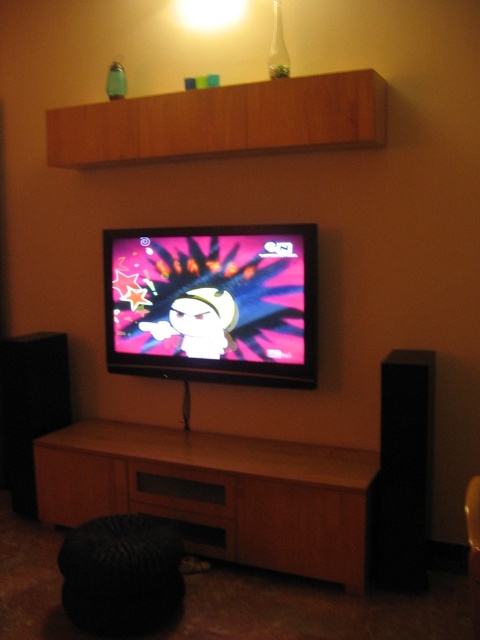
You are setting up a new shelf in the living room and need to know the relative widths of the wooden cabinet at lower center and the black matte speaker at left. Which one is wider?

The wooden cabinet at lower center is wider than the black matte speaker at left according to the description.

You are planning to place a new decorative item on the wooden cabinet at lower center and the black matte speaker at left. If the decorative item requires a surface area of 0.5 square meters, will both objects have enough space individually?

The wooden cabinet at lower center is larger in size than the black matte speaker at left. Therefore, the wooden cabinet at lower center likely has enough space for the decorative item, but the black matte speaker at left may not due to its smaller size.

You are setting up a new TV stand that can only support items up to the size of the black matte speaker at left. Can the flat screen tv at center be placed on this stand?

The flat screen tv at center is bigger than the black matte speaker at left, so it cannot be placed on the stand designed for the speaker.